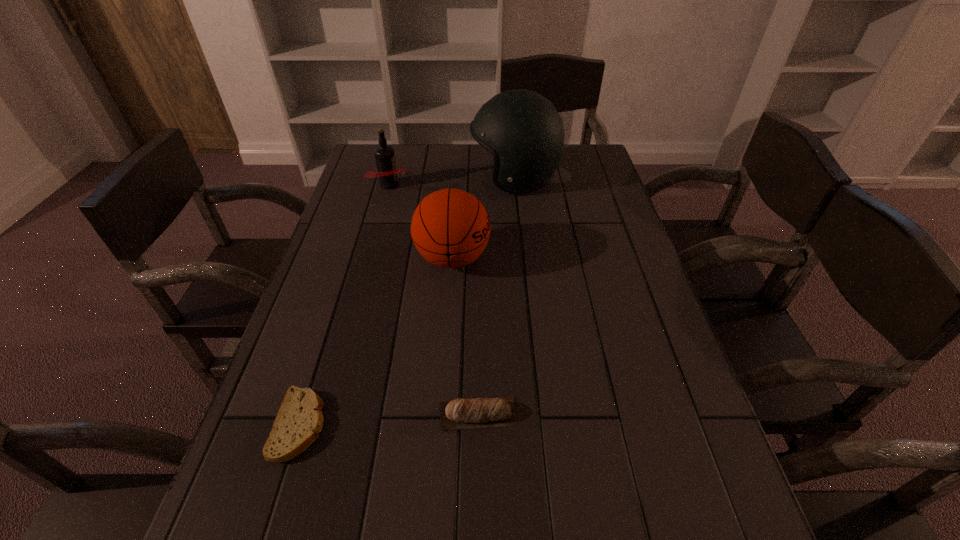
Find the location of a particular element. vacant position located 0.340m on the side with logo of the third nearest object is located at coordinates (617, 259).

The width and height of the screenshot is (960, 540). In order to click on vacant position located on the label of the root beer in this screenshot , I will do `click(502, 185)`.

Locate an element on the screen. The width and height of the screenshot is (960, 540). free region located 0.320m on the right of the right pita bread is located at coordinates (683, 414).

The width and height of the screenshot is (960, 540). I want to click on vacant space located 0.100m on the back of the shorter pita bread, so click(324, 349).

At what (x,y) coordinates should I click in order to perform the action: click on football helmet that is at the far edge. Please return your answer as a coordinate pair (x, y). The width and height of the screenshot is (960, 540). Looking at the image, I should click on click(x=522, y=129).

Image resolution: width=960 pixels, height=540 pixels. What are the coordinates of `root beer situated at the far edge` in the screenshot? It's located at (387, 172).

The width and height of the screenshot is (960, 540). Find the location of `root beer present at the left edge`. root beer present at the left edge is located at coordinates (387, 172).

The width and height of the screenshot is (960, 540). Identify the location of pita bread that is at the left edge. (299, 420).

At what (x,y) coordinates should I click in order to perform the action: click on object that is at the right edge. Please return your answer as a coordinate pair (x, y). The image size is (960, 540). Looking at the image, I should click on (522, 129).

Where is `object present at the far left corner`? object present at the far left corner is located at coordinates (387, 172).